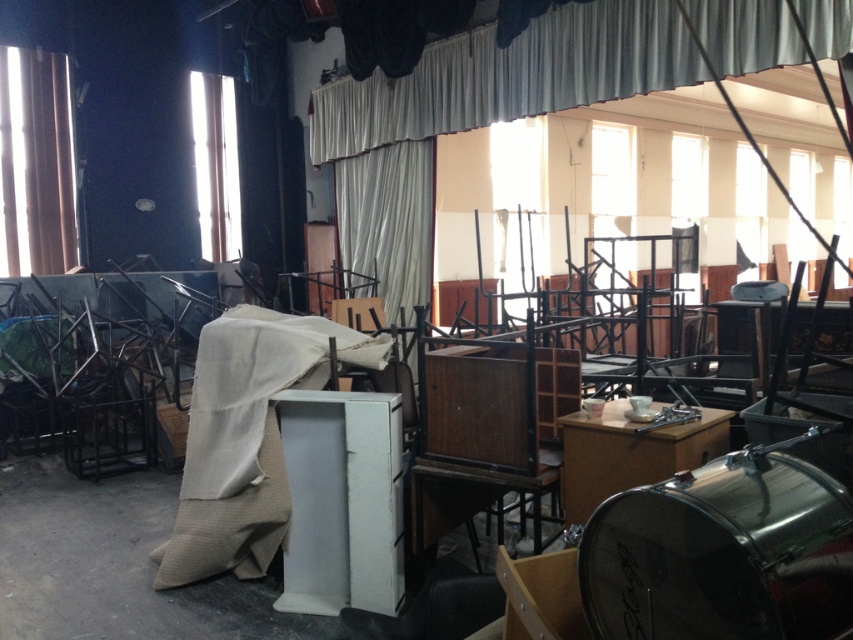
From the picture: You are standing in the center of the room and want to move towards the wooden cabinet at center. Based on the coordinates provided, in which direction should you move?

The wooden cabinet at center is located at coordinates point (x=488, y=432), so you should move towards the right direction from the center to reach it.

You are organizing a temporary exhibition and need to decide which curtain to use for the main stage backdrop. The requirement is that the curtain must be wider than the other. Based on the scene, which curtain should you choose between the white fabric curtain at upper center and the brown fabric curtain at left?

The white fabric curtain at upper center should be chosen because its width surpasses that of the brown fabric curtain at left, making it wider and suitable for the main stage backdrop.

You are an interior designer assessing the space. You notice the white fabric curtain at upper center and the wooden cabinet at center. Which object is shorter in height?

The white fabric curtain at upper center is shorter than the wooden cabinet at center.